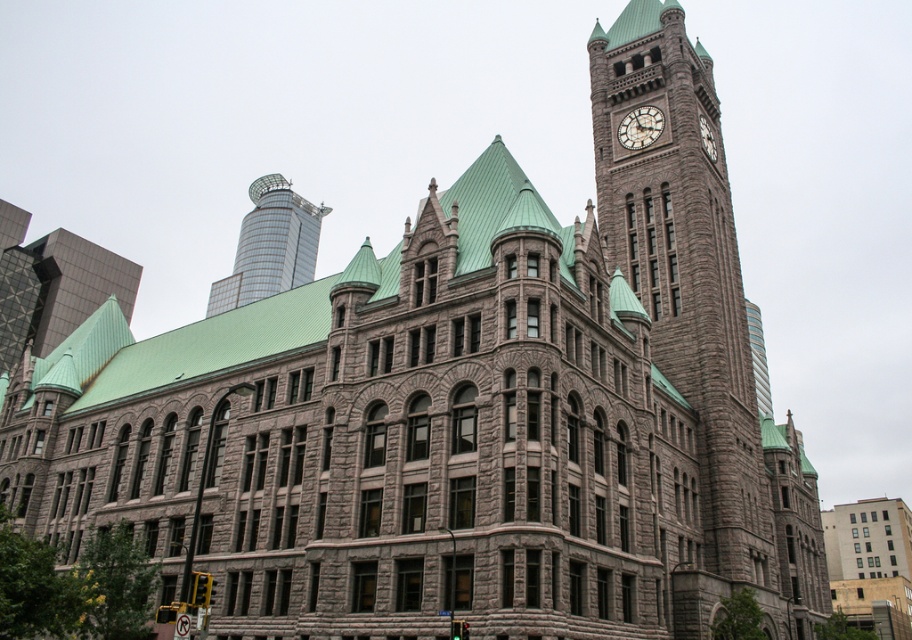
Question: From the image, what is the correct spatial relationship of matte gray clock at upper right in relation to white stone clock at upper right?

Choices:
 (A) right
 (B) left

Answer: (B)

Question: Among these objects, which one is nearest to the camera?

Choices:
 (A) white stone clock at upper right
 (B) matte gray clock at upper right

Answer: (A)

Question: Is matte gray clock at upper right further to camera compared to white stone clock at upper right?

Choices:
 (A) yes
 (B) no

Answer: (A)

Question: Estimate the real-world distances between objects in this image. Which object is farther from the shiny glass skyscraper at upper left?

Choices:
 (A) white stone clock at upper right
 (B) green glass skyscraper at left
 (C) matte gray clock at upper right
 (D) gray stone clock tower at upper center

Answer: (A)

Question: Which point appears farthest from the camera in this image?

Choices:
 (A) (636, 131)
 (B) (757, 552)
 (C) (287, 236)

Answer: (C)

Question: Can you confirm if gray stone clock tower at upper center is bigger than matte gray clock at upper right?

Choices:
 (A) no
 (B) yes

Answer: (B)